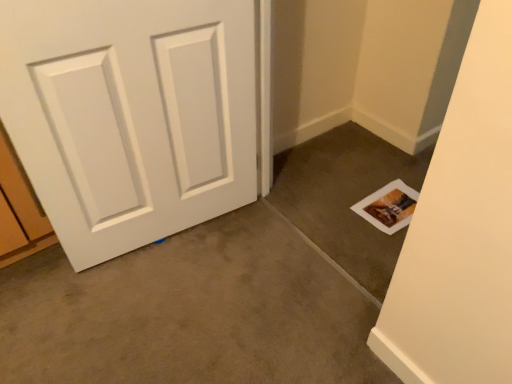
Identify the location of white painted wood door at left. (130, 115).

The image size is (512, 384). Describe the element at coordinates (130, 115) in the screenshot. I see `white painted wood door at left` at that location.

Find the location of a particular element. Image resolution: width=512 pixels, height=384 pixels. white painted wood door at left is located at coordinates (130, 115).